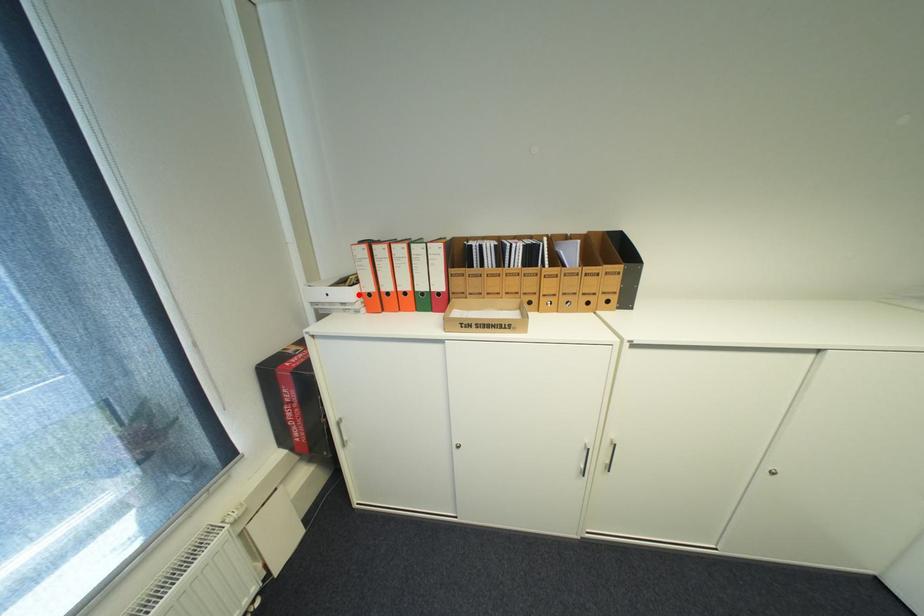
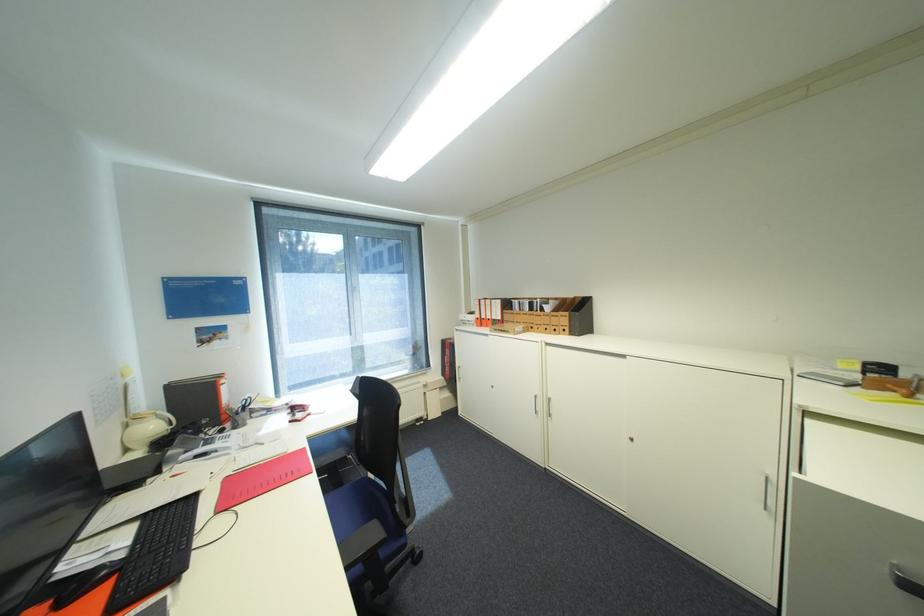
The point at the highlighted location is marked in the first image. Where is the corresponding point in the second image?

(480, 318)